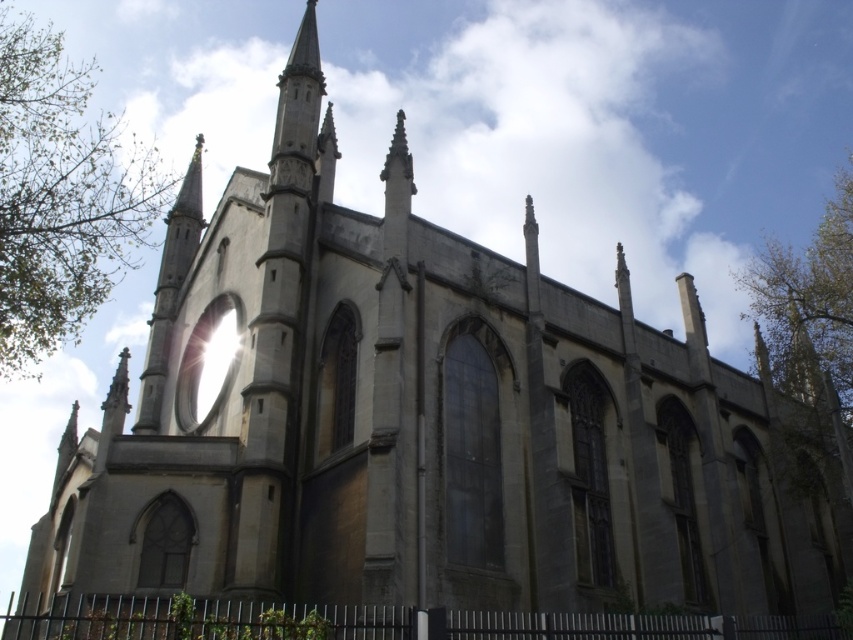
You are a visitor standing in front of the Gothic church and notice two green leafy trees in the scene. Which tree, the green leafy tree at left or the green leafy tree at upper right, appears larger in size?

The green leafy tree at left is bigger than the green leafy tree at upper right.